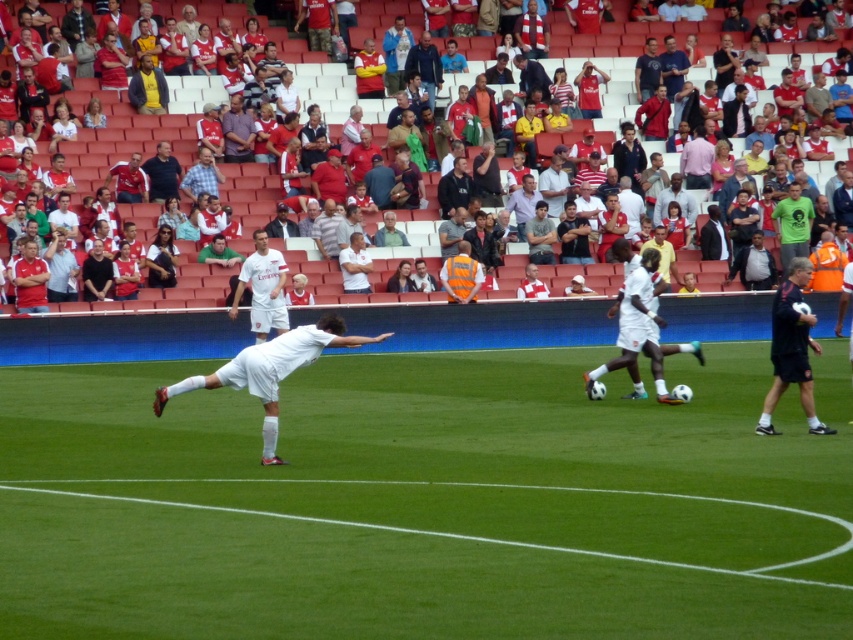
You are a photographer positioned at the edge of the soccer field. You notice two players wearing white jerseys at the center of the field. Which player, the one in the white matte jersey at center or the white jersey at center, is standing closer to the camera?

The white matte jersey at center is much taller as white jersey at center, so the player in the white matte jersey at center is closer to the camera.

You are a photographer standing at the edge of the soccer field. You want to take a photo that includes both the white fabric crowd at upper center and the white smooth soccer ball at right. Based on their positions, which object should you adjust your camera to focus on first to ensure both are in the frame?

The white fabric crowd at upper center is to the left of the white smooth soccer ball at right. To include both in the frame, you should focus on the white smooth soccer ball at right first since it is on the right side, allowing you to adjust the camera to capture the crowd on the left as well.

You are a photographer standing at the edge of the soccer field. You notice the white matte jersey at center and the dark blue shirt at center in your viewfinder. Which one appears lower in your photo?

The white matte jersey at center appears lower in the photo because it is positioned below the dark blue shirt at center.